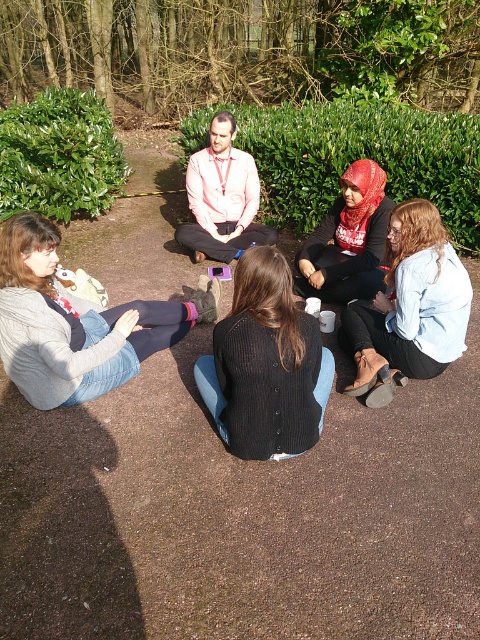
Question: Does black ribbed sweater at center appear over light blue denim jacket at lower right?

Choices:
 (A) no
 (B) yes

Answer: (A)

Question: Which point appears closest to the camera in this image?

Choices:
 (A) (417, 356)
 (B) (9, 346)
 (C) (372, 246)

Answer: (B)

Question: Does green leafy hedge at upper left appear on the left side of matte red scarf at center?

Choices:
 (A) yes
 (B) no

Answer: (A)

Question: Among these objects, which one is farthest from the camera?

Choices:
 (A) matte red scarf at center
 (B) green leafy hedge at upper center
 (C) black ribbed sweater at center
 (D) light blue denim jacket at lower right

Answer: (B)

Question: Is knitted grey sweater at lower left below green leafy hedge at upper left?

Choices:
 (A) yes
 (B) no

Answer: (A)

Question: Estimate the real-world distances between objects in this image. Which object is farther from the matte red scarf at center?

Choices:
 (A) light blue denim jacket at lower right
 (B) green leafy hedge at upper left
 (C) black ribbed sweater at center

Answer: (B)